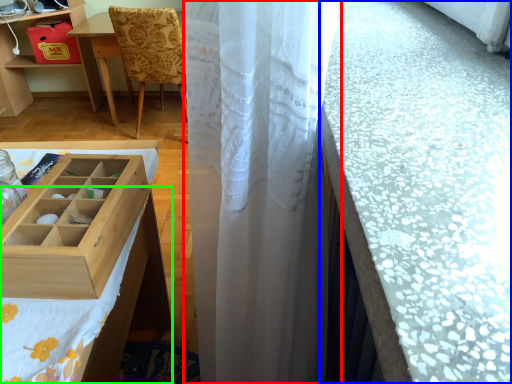
Question: Which object is positioned farthest from curtain (highlighted by a red box)? Select from counter top (highlighted by a blue box) and tablecloth (highlighted by a green box).

Choices:
 (A) counter top
 (B) tablecloth

Answer: (B)